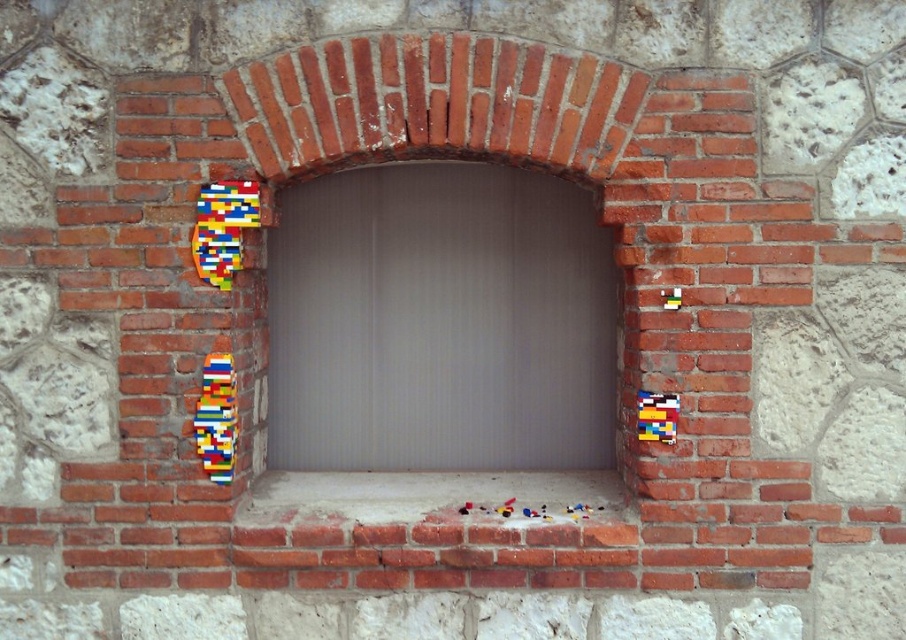
You are standing in front of the brick archway and want to place a small decoration. You have two points marked on the structure, point (390, 314) and point (282, 516). Which point is closer to you?

Point (390, 314) is further to the camera than point (282, 516), so point (282, 516) is closer to you.

You are a delivery person carrying a box that is 1.2 meters wide. You need to pass through the archway in the image. The brick at center and white concrete at center form part of the archway. Can your box fit through the archway?

The brick at center is wider than the white concrete at center. Since the box is 1.2 meters wide, it depends on the narrower part of the archway. If the white concrete at center is the narrower part, then the box may not fit. However, without exact measurements, it is uncertain. Please check the actual width of the narrower section.